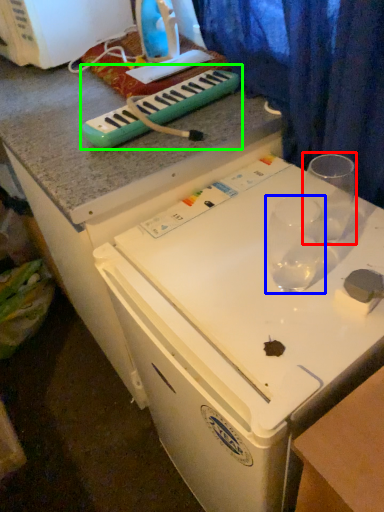
Question: Estimate the real-world distances between objects in this image. Which object is closer to martini glass (highlighted by a red box), martini glass (highlighted by a blue box) or musical keyboard (highlighted by a green box)?

Choices:
 (A) martini glass
 (B) musical keyboard

Answer: (A)